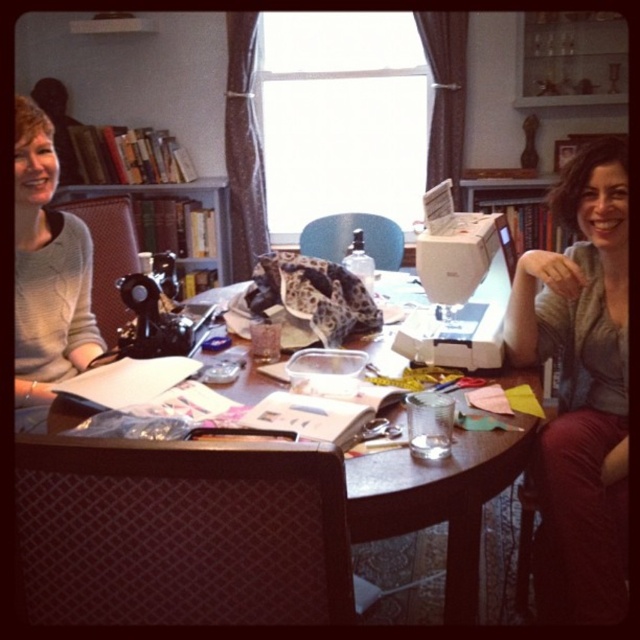
You are organizing the room and want to move the matte gray sweater at right to the wooden bookshelf at upper left. Can you place it directly behind the sweater without moving the sweater first?

The matte gray sweater at right is currently in front of the wooden bookshelf at upper left, so to place it directly behind the sweater, you would need to move the sweater first to access the space behind it.

You are standing in the room and want to reach both the point at coordinates point (419, 544) and point (42, 140). Which point is closer to you?

Point (42, 140) is closer to you because it is less further than point (419, 544).

You are trying to decide whether to place a new box of sewing supplies on the wooden table at center or next to the light gray sweater at left. Based on their heights, which surface would allow the box to be more visible?

The light gray sweater at left is taller than the wooden table at center, so placing the box on the wooden table at center would make it more visible since it would be higher up.